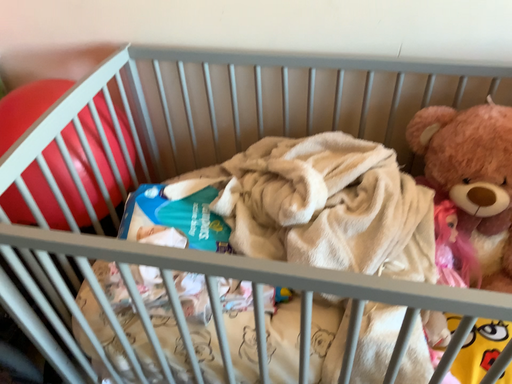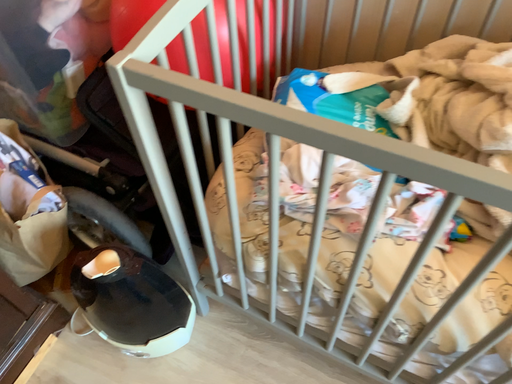
Question: How did the camera likely rotate when shooting the video?

Choices:
 (A) rotated downward
 (B) rotated upward

Answer: (A)